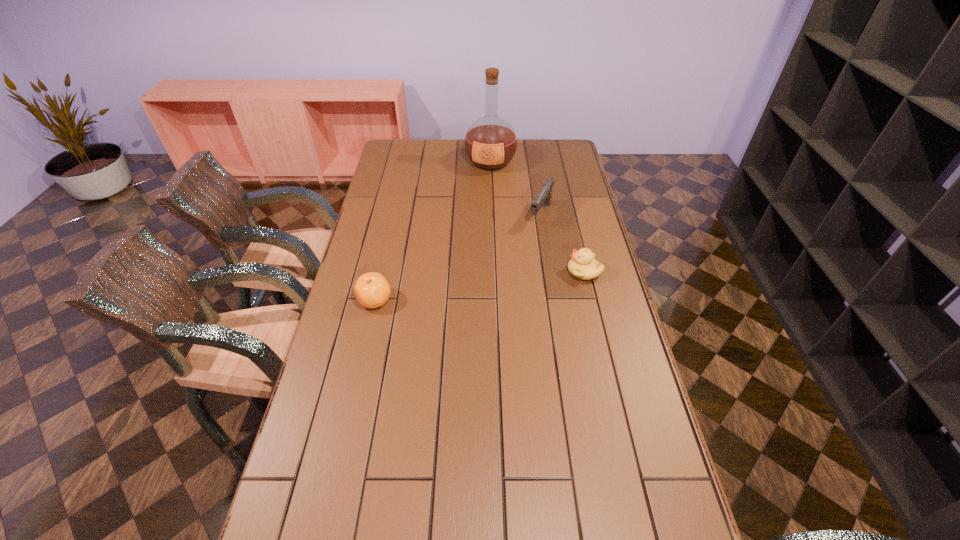
Find the location of a particular element. clementine is located at coordinates (372, 290).

Where is `the leftmost object`? The image size is (960, 540). the leftmost object is located at coordinates (372, 290).

This screenshot has height=540, width=960. Find the location of `the second nearest object`. the second nearest object is located at coordinates (583, 266).

Where is `the rightmost object`? Image resolution: width=960 pixels, height=540 pixels. the rightmost object is located at coordinates (583, 266).

The width and height of the screenshot is (960, 540). I want to click on the second object from right to left, so click(x=544, y=195).

The height and width of the screenshot is (540, 960). Find the location of `the second farthest object`. the second farthest object is located at coordinates (544, 195).

The height and width of the screenshot is (540, 960). Find the location of `the second object from left to right`. the second object from left to right is located at coordinates click(490, 143).

Where is `the farthest object`? The image size is (960, 540). the farthest object is located at coordinates (490, 143).

Identify the location of vacant area located on the back of the clementine. The height and width of the screenshot is (540, 960). (390, 233).

Identify the location of free space located 0.190m on the beak of the duckling. (512, 272).